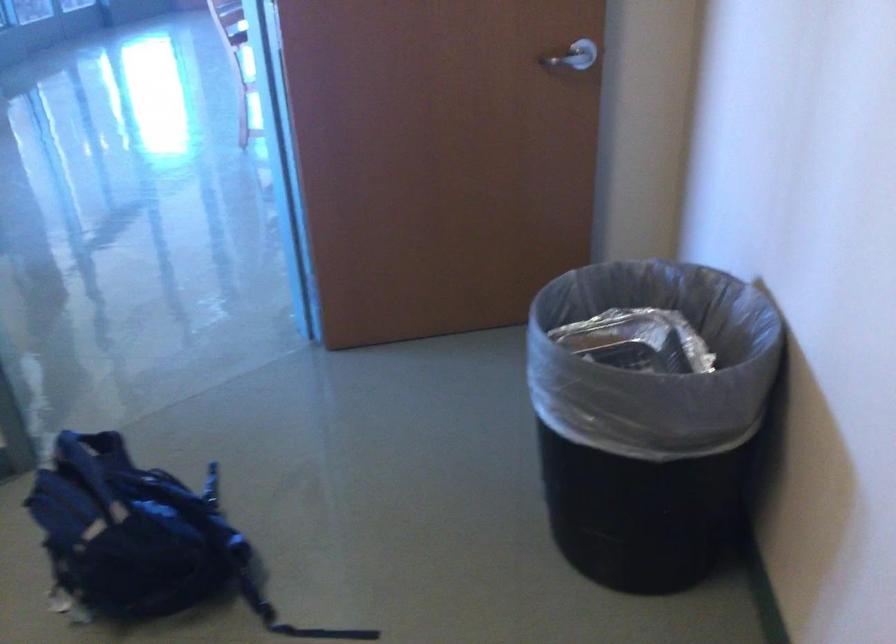
Where is `silver door handle`? Image resolution: width=896 pixels, height=644 pixels. silver door handle is located at coordinates (571, 60).